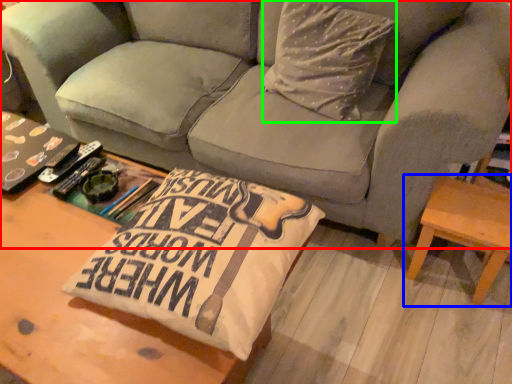
Question: Considering the real-world distances, which object is closest to studio couch (highlighted by a red box)? table (highlighted by a blue box) or throw pillow (highlighted by a green box).

Choices:
 (A) table
 (B) throw pillow

Answer: (B)